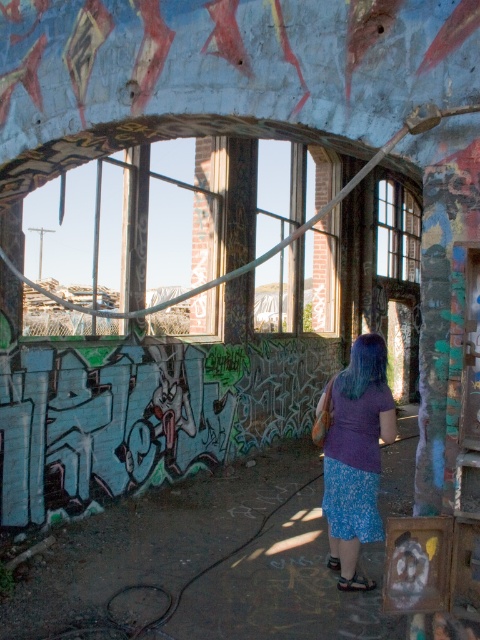
You are a photographer trying to capture the purple fabric skirt at center. You are standing at point (356, 456). Which direction should you move to get a better angle of the purple fabric skirt at center?

Since the purple fabric skirt at center is located at point (356, 456), you are already at the optimal position to capture it. No movement is necessary.

You are standing in the abandoned building and want to throw a small stone through the clear glass window at center. The purple fabric skirt at center is in your way. Can you reach the window without moving the skirt?

The purple fabric skirt at center is 9.60 meters away from the clear glass window at center, so you can reach the window without moving the skirt since they are separated by a significant distance.

You are navigating through an abandoned building and need to reach a point that is in front of another point. Which of the two points, point (332,419) or point (415,221), should you move towards first?

You should move towards point (332,419) first because it is in front of point (415,221) according to the spatial description.